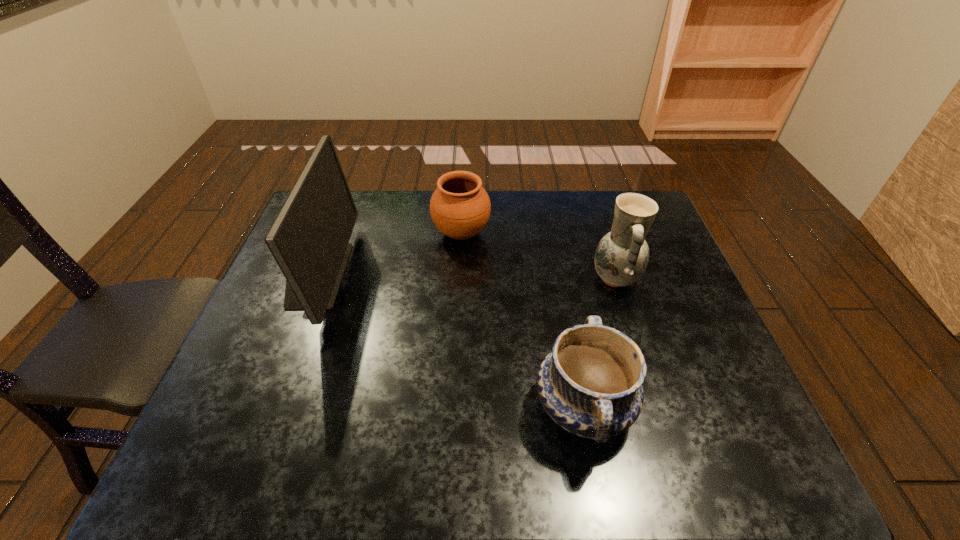
Image resolution: width=960 pixels, height=540 pixels. I want to click on vacant region between the farthest pottery and the tallest object, so click(389, 254).

Where is `free point between the farthest pottery and the computer monitor`? free point between the farthest pottery and the computer monitor is located at coordinates (389, 254).

Select which object appears as the third closest to the second tallest object. Please provide its 2D coordinates. Your answer should be formatted as a tuple, i.e. [(x, y)], where the tuple contains the x and y coordinates of a point satisfying the conditions above.

[(309, 239)]

I want to click on object that is the third closest to the nearest pottery, so click(x=309, y=239).

Select which pottery appears as the second closest to the second farthest pottery. Please provide its 2D coordinates. Your answer should be formatted as a tuple, i.e. [(x, y)], where the tuple contains the x and y coordinates of a point satisfying the conditions above.

[(460, 207)]

Choose which pottery is the nearest neighbor to the nearest object. Please provide its 2D coordinates. Your answer should be formatted as a tuple, i.e. [(x, y)], where the tuple contains the x and y coordinates of a point satisfying the conditions above.

[(622, 255)]

The image size is (960, 540). I want to click on free location that satisfies the following two spatial constraints: 1. on the back side of the nearest pottery; 2. on the screen side of the leftmost object, so click(x=559, y=274).

Locate an element on the screen. blank space that satisfies the following two spatial constraints: 1. on either side of the tallest pottery; 2. on the front side of the nearest pottery is located at coordinates point(656,407).

Where is `vacant space that satisfies the following two spatial constraints: 1. on the front side of the farthest pottery; 2. on the screen side of the tallest object`? This screenshot has width=960, height=540. vacant space that satisfies the following two spatial constraints: 1. on the front side of the farthest pottery; 2. on the screen side of the tallest object is located at coordinates (459, 274).